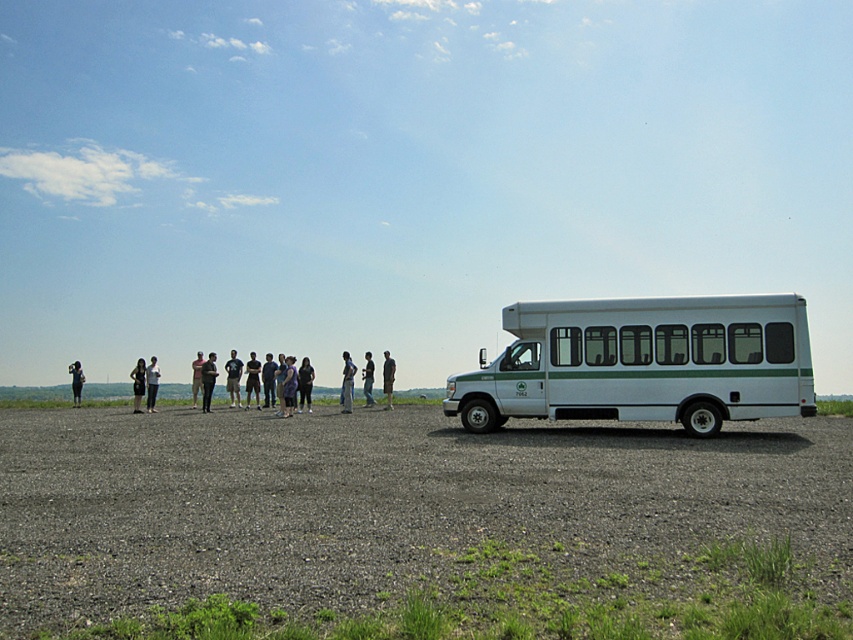
You are a photographer trying to capture a group photo of the dark gray shirt at center and the light brown fabric shirt at center. Which person should you focus on first if you want to ensure their entire body fits in the frame?

You should focus on the light brown fabric shirt at center first because it is wider than the dark gray shirt at center, ensuring their entire body fits in the frame.

You are a photographer trying to capture a group photo of the dark gray shirt at center and the light brown fabric shirt at center. Which person should you focus on first if you want to ensure the tallest person is in focus?

The light brown fabric shirt at center is taller than the dark gray shirt at center, so you should focus on the light brown fabric shirt at center first to ensure the tallest person is in focus.

From the picture: You are a photographer trying to capture a group photo of the people in the midground. You notice the light brown leather jacket at center and the light blue jeans at center. Which clothing item is narrower in width?

The light brown leather jacket at center is narrower in width than the light blue jeans at center.